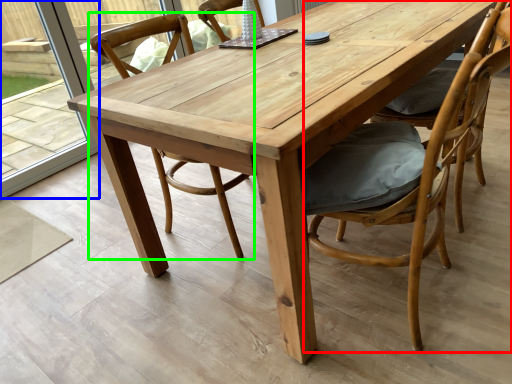
Question: Considering the real-world distances, which object is closest to chair (highlighted by a red box)? glass door (highlighted by a blue box) or chair (highlighted by a green box).

Choices:
 (A) glass door
 (B) chair

Answer: (B)